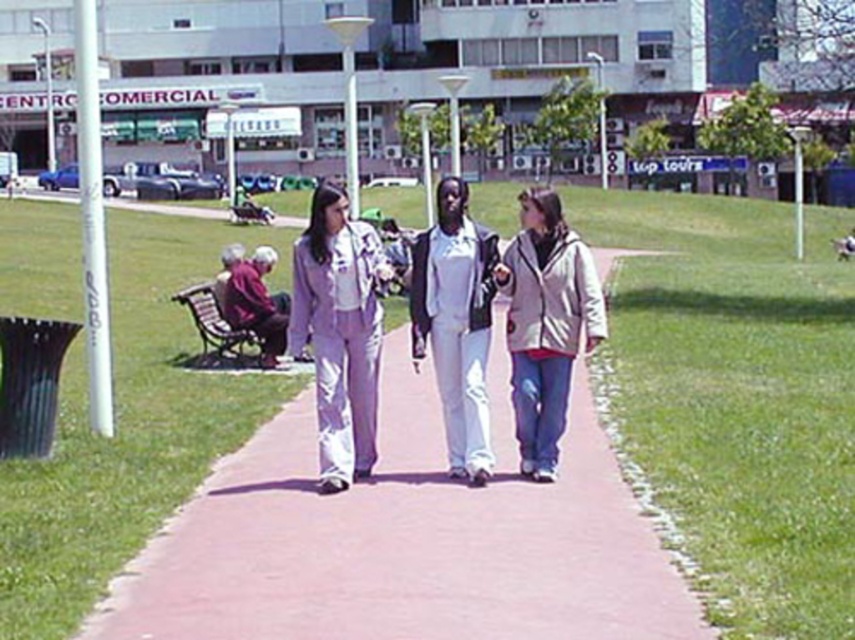
Between beige fleece jacket at center and white matte pants at center, which one appears on the right side from the viewer's perspective?

From the viewer's perspective, beige fleece jacket at center appears more on the right side.

Which of these two, beige fleece jacket at center or white matte pants at center, stands shorter?

Standing shorter between the two is beige fleece jacket at center.

Between point (538, 304) and point (460, 214), which one is positioned in front?

Point (460, 214) is more forward.

Where is `beige fleece jacket at center`? The image size is (855, 640). beige fleece jacket at center is located at coordinates (545, 323).

Based on the photo, is the position of matte white suit at center less distant than that of beige fleece jacket at center?

Yes, matte white suit at center is in front of beige fleece jacket at center.

Is point (375, 284) behind point (522, 280)?

No, it is in front of (522, 280).

Does point (355, 412) lie in front of point (543, 330)?

No, it is behind (543, 330).

I want to click on matte white suit at center, so point(339,332).

Is matte white suit at center thinner than white matte pants at center?

No, matte white suit at center is not thinner than white matte pants at center.

Which of these two, matte white suit at center or white matte pants at center, stands shorter?

Standing shorter between the two is matte white suit at center.

Who is more forward, (345,273) or (441,298)?

Point (345,273)

Locate an element on the screen. The width and height of the screenshot is (855, 640). matte white suit at center is located at coordinates (339, 332).